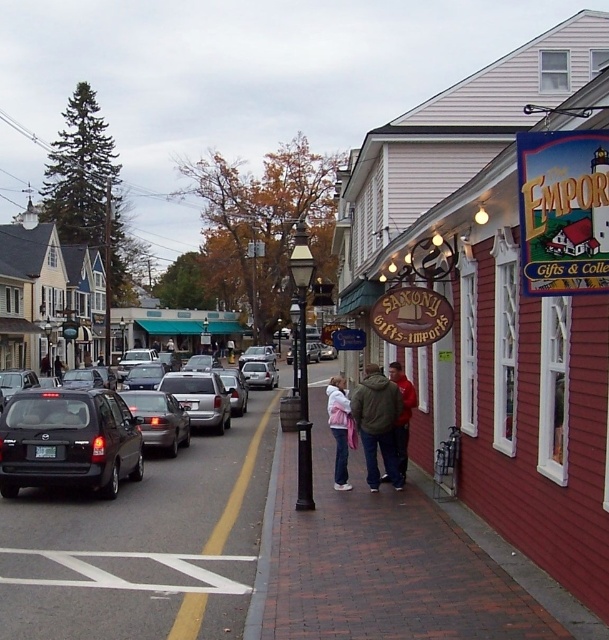
Between matte black sedan at left and pink fleece jacket at center, which one has less height?

Standing shorter between the two is matte black sedan at left.

How far apart are matte black sedan at left and pink fleece jacket at center?

The distance of matte black sedan at left from pink fleece jacket at center is 4.07 meters.

Between point (178, 429) and point (336, 420), which one is positioned in front?

Positioned in front is point (336, 420).

Find the location of a particular element. matte black sedan at left is located at coordinates pyautogui.click(x=96, y=433).

Does red wooden sign at right have a greater height compared to matte black sedan at left?

Correct, red wooden sign at right is much taller as matte black sedan at left.

Can you confirm if red wooden sign at right is positioned below matte black sedan at left?

No, red wooden sign at right is not below matte black sedan at left.

Identify the location of red wooden sign at right. (495, 301).

In the scene shown: Is the position of matte black suv at center-left more distant than that of pink fleece jacket at center?

No, it is in front of pink fleece jacket at center.

Does point (110, 454) lie in front of point (343, 429)?

Yes, point (110, 454) is closer to viewer.

Between point (35, 403) and point (328, 397), which one is positioned behind?

The point (328, 397) is more distant.

Identify the location of matte black suv at center-left. This screenshot has height=640, width=609. (68, 442).